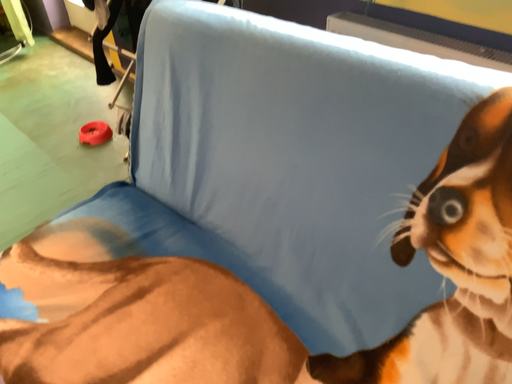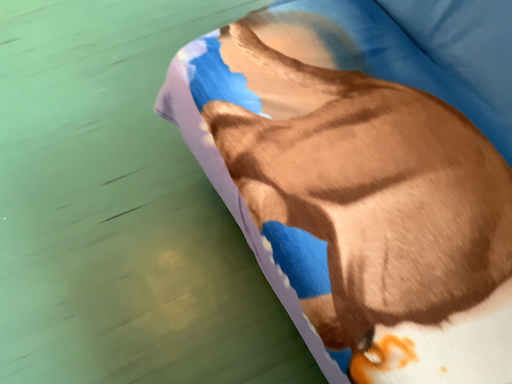
Question: Which way did the camera rotate in the video?

Choices:
 (A) rotated downward
 (B) rotated upward

Answer: (A)